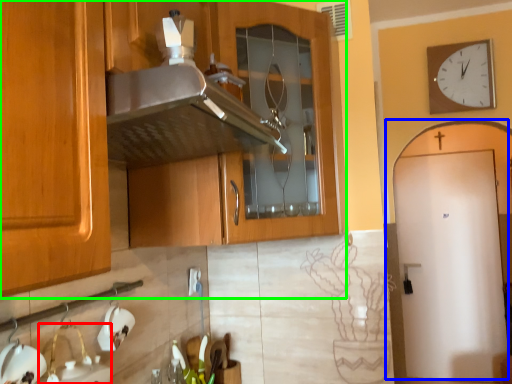
Question: Which object is positioned closest to sink (highlighted by a red box)? Select from door (highlighted by a blue box) and cabinetry (highlighted by a green box).

Choices:
 (A) door
 (B) cabinetry

Answer: (B)